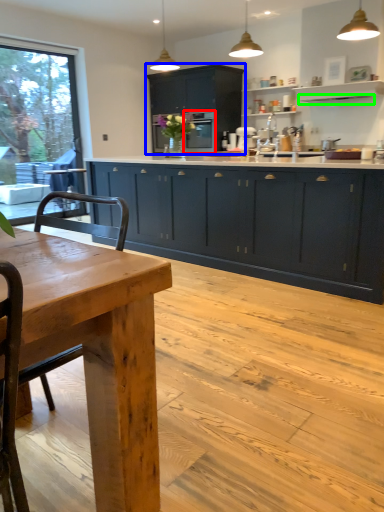
Question: Based on their relative distances, which object is nearer to screen door (highlighted by a red box)? Choose from cabinetry (highlighted by a blue box) and exhaust hood (highlighted by a green box).

Choices:
 (A) cabinetry
 (B) exhaust hood

Answer: (A)